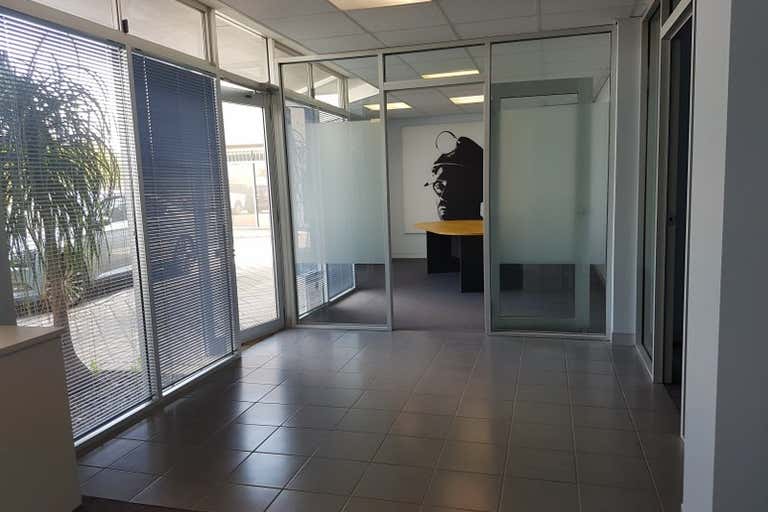
The image size is (768, 512). What are the coordinates of `open doorway` in the screenshot? It's located at click(x=437, y=294).